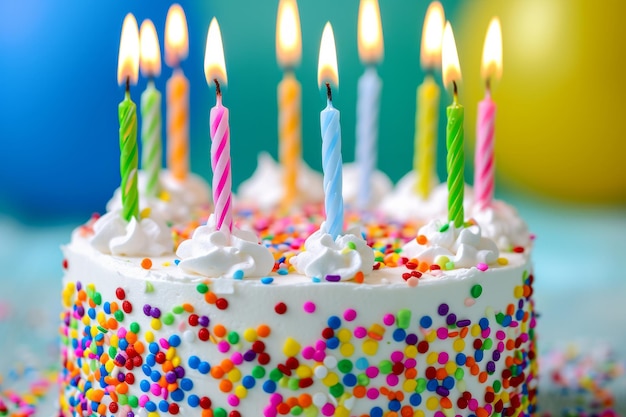
The width and height of the screenshot is (626, 417). I want to click on birthday cake candles, so click(332, 192), click(370, 138), click(290, 140), click(423, 130), click(451, 182), click(484, 154), click(218, 168), click(182, 118), click(153, 142), click(130, 173).